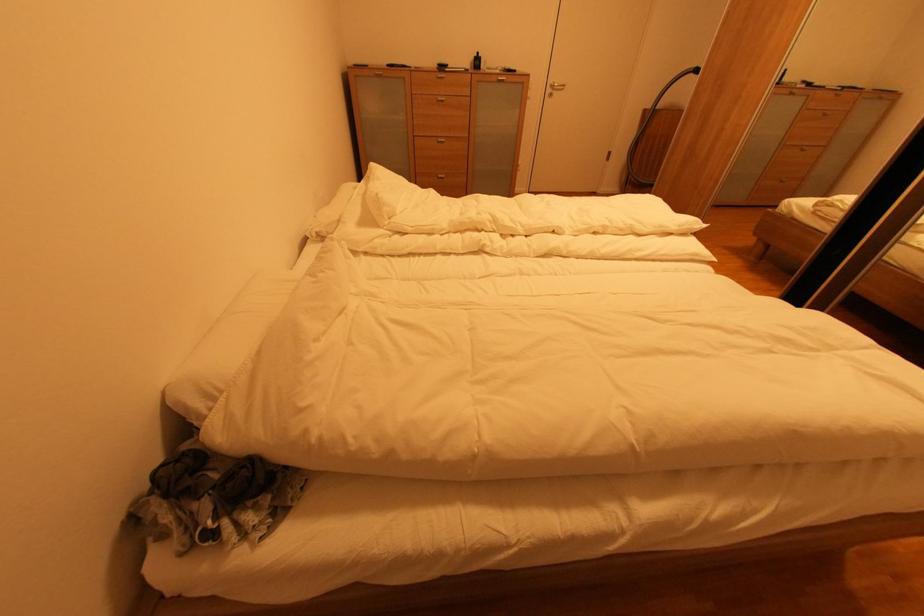
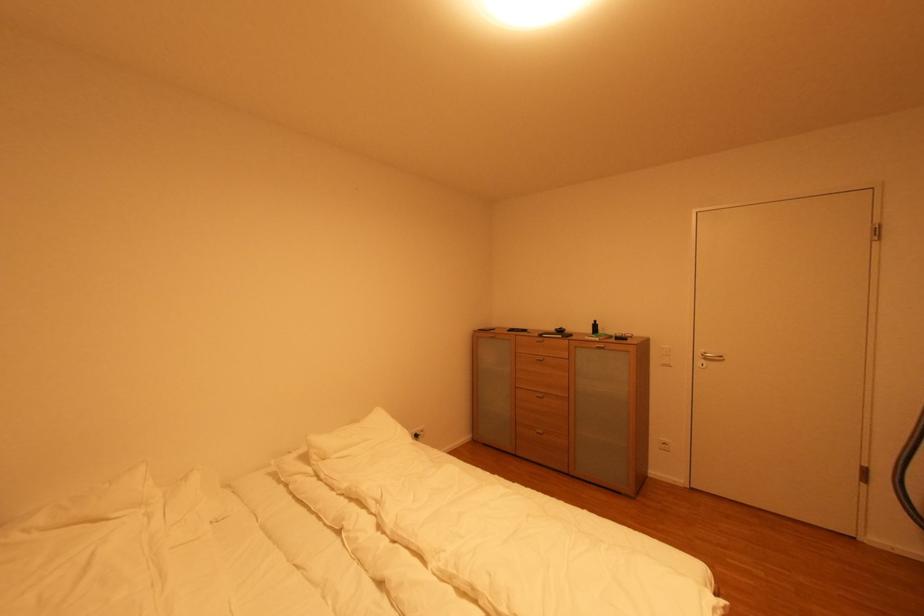
Where in the second image is the point corresponding to point (520, 71) from the first image?

(630, 339)